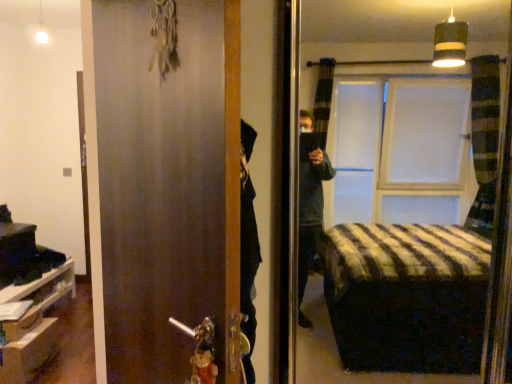
Question: Is matte brown door at center placed right next to wooden drawer at lower left?

Choices:
 (A) no
 (B) yes

Answer: (A)

Question: Is matte brown door at center not within wooden drawer at lower left?

Choices:
 (A) yes
 (B) no

Answer: (A)

Question: From the image's perspective, would you say matte brown door at center is positioned over wooden drawer at lower left?

Choices:
 (A) yes
 (B) no

Answer: (A)

Question: Does matte brown door at center have a smaller size compared to wooden drawer at lower left?

Choices:
 (A) yes
 (B) no

Answer: (B)

Question: Are matte brown door at center and wooden drawer at lower left far apart?

Choices:
 (A) yes
 (B) no

Answer: (A)

Question: Is matte brown door at center bigger than wooden drawer at lower left?

Choices:
 (A) yes
 (B) no

Answer: (A)

Question: Does matte brown door at center have a greater width compared to white matte cabinet at lower left?

Choices:
 (A) yes
 (B) no

Answer: (B)

Question: Considering the relative sizes of matte brown door at center and white matte cabinet at lower left in the image provided, is matte brown door at center shorter than white matte cabinet at lower left?

Choices:
 (A) no
 (B) yes

Answer: (A)

Question: Does matte brown door at center have a smaller size compared to white matte cabinet at lower left?

Choices:
 (A) no
 (B) yes

Answer: (A)

Question: Considering the relative positions of matte brown door at center and white matte cabinet at lower left in the image provided, is matte brown door at center behind white matte cabinet at lower left?

Choices:
 (A) no
 (B) yes

Answer: (A)

Question: Could you tell me if matte brown door at center is facing white matte cabinet at lower left?

Choices:
 (A) no
 (B) yes

Answer: (A)

Question: From the image's perspective, is matte brown door at center under white matte cabinet at lower left?

Choices:
 (A) no
 (B) yes

Answer: (A)

Question: From a real-world perspective, is white matte cabinet at lower left over matte brown door at center?

Choices:
 (A) yes
 (B) no

Answer: (B)